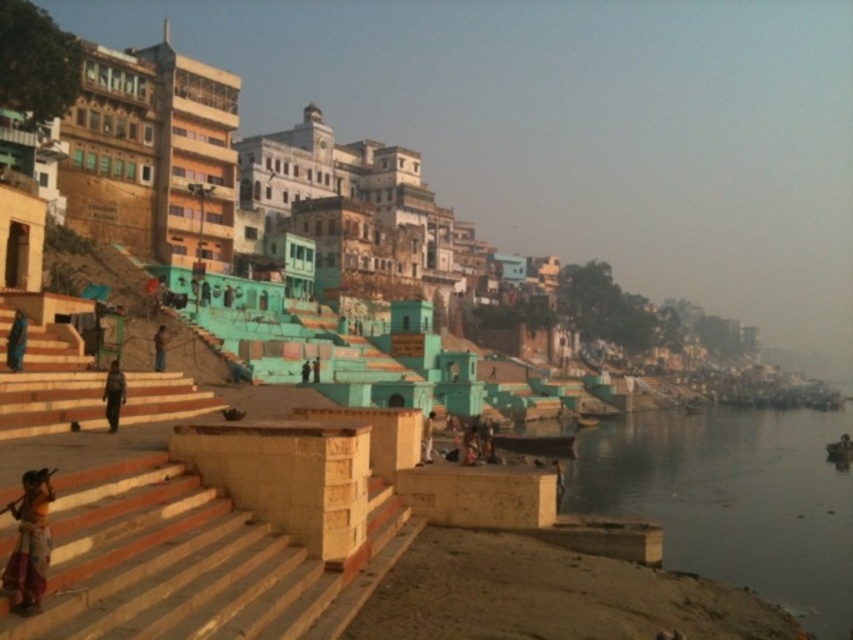
Does orange cotton sari at lower left lie behind brown leather bag at lower left?

No, it is not.

Between orange cotton sari at lower left and brown leather bag at lower left, which one appears on the right side from the viewer's perspective?

orange cotton sari at lower left is more to the right.

Identify the location of orange cotton sari at lower left. (28, 541).

Does dark blue fabric at lower left appear on the right side of dark blue fabric person at center?

No, dark blue fabric at lower left is not to the right of dark blue fabric person at center.

Is point (18, 321) behind point (314, 372)?

No, it is not.

You are a GUI agent. You are given a task and a screenshot of the screen. Output one action in this format:
    pyautogui.click(x=<x>, y=<y>)
    Task: Click on the dark blue fabric at lower left
    Image resolution: width=853 pixels, height=640 pixels.
    Given the screenshot: What is the action you would take?
    pyautogui.click(x=16, y=340)

Where is `dark blue fabric at lower left`? dark blue fabric at lower left is located at coordinates (16, 340).

Between point (247, 596) and point (108, 392), which one is positioned in front?

Positioned in front is point (247, 596).

Is point (212, 532) farther from viewer compared to point (123, 380)?

No, it is in front of (123, 380).

Which is in front, point (216, 598) or point (114, 412)?

Positioned in front is point (216, 598).

Find the location of a particular element. The width and height of the screenshot is (853, 640). beige stone stairs at lower left is located at coordinates (190, 563).